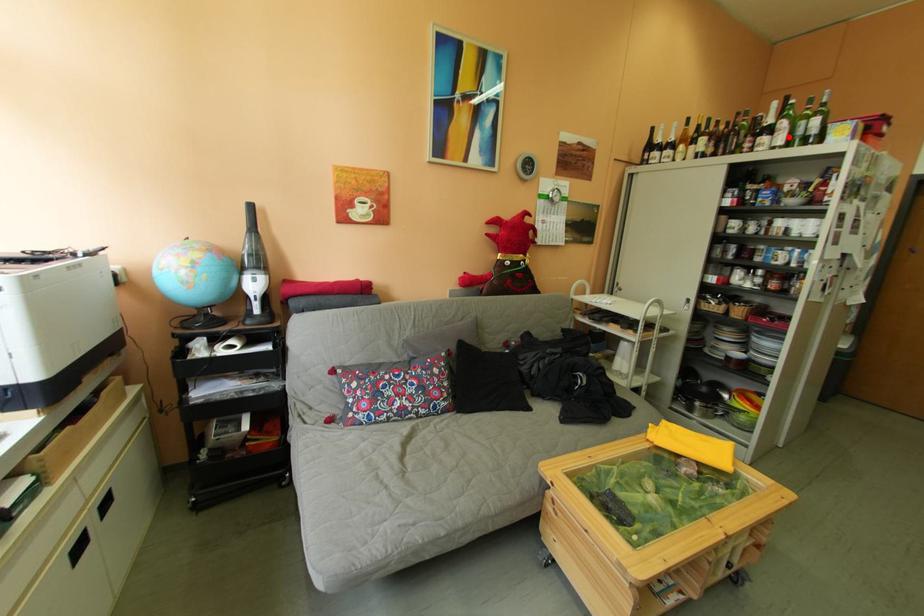
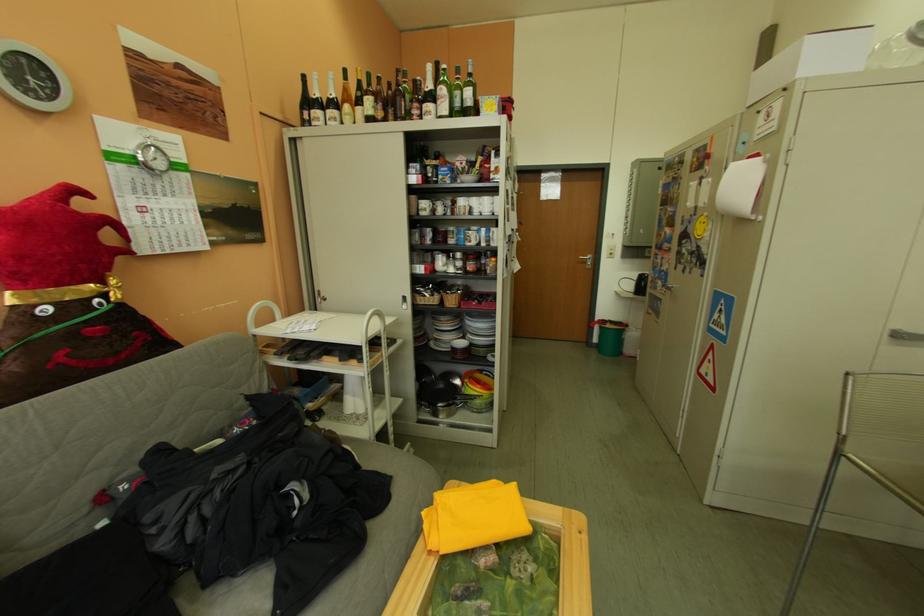
Find the pixel in the second image that matches the highlighted location in the first image.

(452, 105)